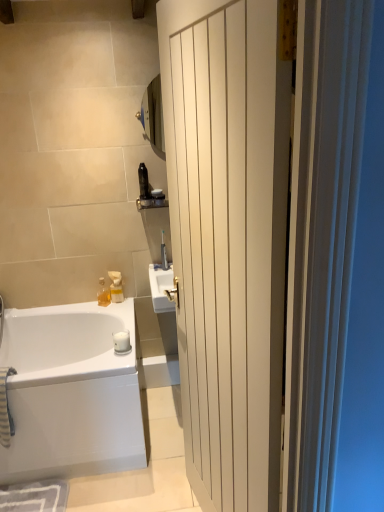
Question: Does satin nickel faucet at upper center appear on the right side of black plastic bottle at upper center, which ranks as the 4th toiletry in bottom-to-top order?

Choices:
 (A) no
 (B) yes

Answer: (B)

Question: Is satin nickel faucet at upper center to the left of black plastic bottle at upper center, which ranks as the 4th toiletry in bottom-to-top order, from the viewer's perspective?

Choices:
 (A) yes
 (B) no

Answer: (B)

Question: Considering the relative sizes of satin nickel faucet at upper center and black plastic bottle at upper center, which ranks as the 4th toiletry in bottom-to-top order, in the image provided, is satin nickel faucet at upper center thinner than black plastic bottle at upper center, which ranks as the 4th toiletry in bottom-to-top order,?

Choices:
 (A) yes
 (B) no

Answer: (A)

Question: Is satin nickel faucet at upper center positioned far away from black plastic bottle at upper center, arranged as the 2th toiletry when viewed from the right?

Choices:
 (A) yes
 (B) no

Answer: (B)

Question: Is black plastic bottle at upper center, which ranks as the third toiletry in left-to-right order, surrounded by satin nickel faucet at upper center?

Choices:
 (A) no
 (B) yes

Answer: (A)

Question: From the image's perspective, is matte black toothbrush at upper center, arranged as the fourth toiletry when viewed from the left, positioned above or below white matte soap at lower center?

Choices:
 (A) below
 (B) above

Answer: (B)

Question: Based on their sizes in the image, would you say matte black toothbrush at upper center, the 1th toiletry viewed from the right, is bigger or smaller than white matte soap at lower center?

Choices:
 (A) big
 (B) small

Answer: (B)

Question: From a real-world perspective, is matte black toothbrush at upper center, arranged as the fourth toiletry when viewed from the left, physically located above or below white matte soap at lower center?

Choices:
 (A) above
 (B) below

Answer: (A)

Question: In terms of width, does matte black toothbrush at upper center, arranged as the fourth toiletry when viewed from the left, look wider or thinner when compared to white matte soap at lower center?

Choices:
 (A) thin
 (B) wide

Answer: (A)

Question: Would you say white wood door at center is to the left or to the right of matte black toothbrush at upper center, arranged as the fourth toiletry when viewed from the left, in the picture?

Choices:
 (A) left
 (B) right

Answer: (B)

Question: Does point (261, 32) appear closer or farther from the camera than point (160, 199)?

Choices:
 (A) farther
 (B) closer

Answer: (B)

Question: Looking at their shapes, would you say white wood door at center is wider or thinner than matte black toothbrush at upper center, arranged as the fourth toiletry when viewed from the left?

Choices:
 (A) thin
 (B) wide

Answer: (B)

Question: From the image's perspective, is white wood door at center above or below matte black toothbrush at upper center, arranged as the fourth toiletry when viewed from the left?

Choices:
 (A) below
 (B) above

Answer: (A)

Question: In the image, is matte black toothbrush at upper center, which is counted as the third toiletry, starting from the bottom, on the left side or the right side of translucent plastic soap dispenser at upper center, the 3th toiletry from the right?

Choices:
 (A) right
 (B) left

Answer: (A)

Question: From a real-world perspective, is matte black toothbrush at upper center, arranged as the fourth toiletry when viewed from the left, positioned above or below translucent plastic soap dispenser at upper center, which is counted as the second toiletry, starting from the bottom?

Choices:
 (A) above
 (B) below

Answer: (A)